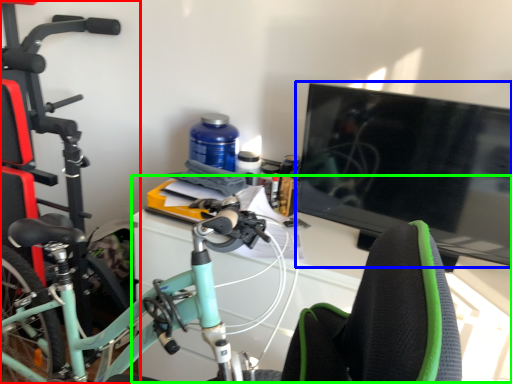
Question: Which is farther away from bicycle (highlighted by a red box)? television (highlighted by a blue box) or computer desk (highlighted by a green box)?

Choices:
 (A) television
 (B) computer desk

Answer: (A)